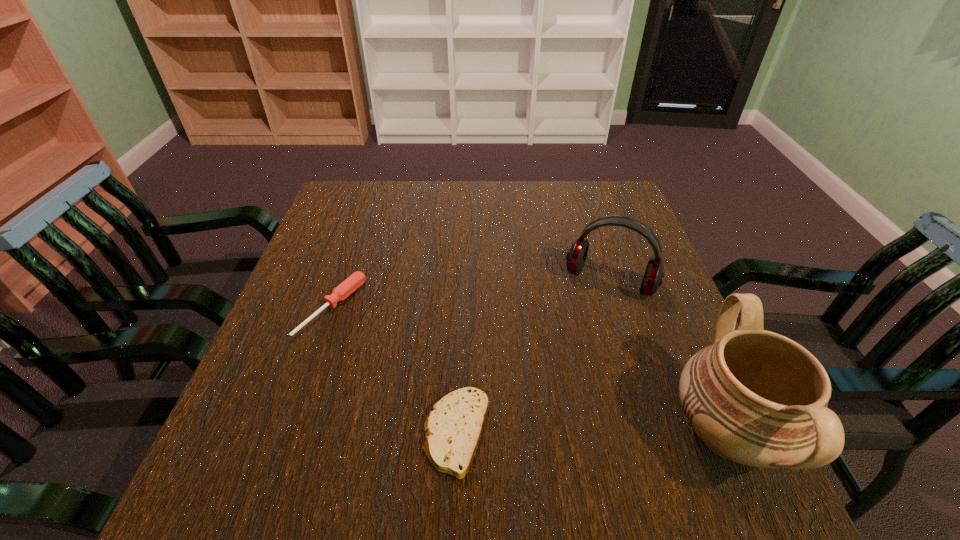
The height and width of the screenshot is (540, 960). In order to click on unoccupied position between the tallest object and the screwdriver in this screenshot , I will do `click(529, 370)`.

What are the coordinates of `free space that is in between the urn and the screwdriver` in the screenshot? It's located at (529, 370).

This screenshot has width=960, height=540. Find the location of `free space between the leftmost object and the earphone`. free space between the leftmost object and the earphone is located at coordinates (470, 294).

The height and width of the screenshot is (540, 960). Find the location of `free area in between the third object from right to left and the tallest object`. free area in between the third object from right to left and the tallest object is located at coordinates (591, 433).

Identify the location of free spot between the screwdriver and the shortest object. (395, 370).

Locate an element on the screen. This screenshot has height=540, width=960. free space between the earphone and the urn is located at coordinates (668, 357).

Identify the location of object that stands as the third closest to the leftmost object. The height and width of the screenshot is (540, 960). (755, 397).

Find the location of a particular element. Image resolution: width=960 pixels, height=540 pixels. object identified as the third closest to the urn is located at coordinates (347, 287).

Identify the location of vacant space that satisfies the following two spatial constraints: 1. on the back side of the pita bread; 2. on the right side of the earphone. (463, 281).

I want to click on free space that satisfies the following two spatial constraints: 1. on the front side of the earphone; 2. on the front-facing side of the tallest object, so click(x=659, y=433).